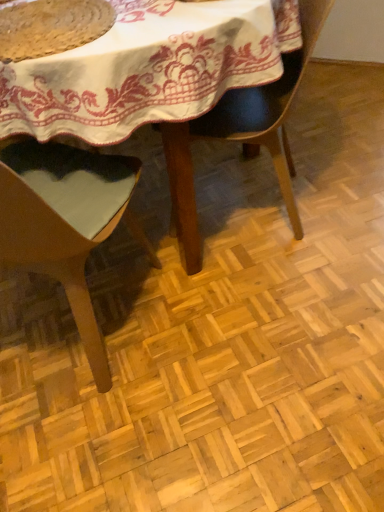
Question: Is light brown wood chair at center, which ranks as the 1th chair in left-to-right order, closer to the viewer compared to rustic woven mat at upper left?

Choices:
 (A) no
 (B) yes

Answer: (B)

Question: Does light brown wood chair at center, which ranks as the 1th chair in left-to-right order, have a lesser height compared to rustic woven mat at upper left?

Choices:
 (A) no
 (B) yes

Answer: (A)

Question: Is light brown wood chair at center, arranged as the second chair when viewed from the right, bigger than rustic woven mat at upper left?

Choices:
 (A) yes
 (B) no

Answer: (A)

Question: From a real-world perspective, is light brown wood chair at center, arranged as the second chair when viewed from the right, on rustic woven mat at upper left?

Choices:
 (A) no
 (B) yes

Answer: (A)

Question: Considering the relative sizes of light brown wood chair at center, arranged as the second chair when viewed from the right, and rustic woven mat at upper left in the image provided, is light brown wood chair at center, arranged as the second chair when viewed from the right, thinner than rustic woven mat at upper left?

Choices:
 (A) no
 (B) yes

Answer: (A)

Question: Considering the positions of point (29, 38) and point (246, 0), is point (29, 38) closer or farther from the camera than point (246, 0)?

Choices:
 (A) farther
 (B) closer

Answer: (B)

Question: From their relative heights in the image, would you say rustic woven mat at upper left is taller or shorter than wooden table at center?

Choices:
 (A) tall
 (B) short

Answer: (B)

Question: From the image's perspective, is rustic woven mat at upper left positioned above or below wooden table at center?

Choices:
 (A) below
 (B) above

Answer: (A)

Question: From a real-world perspective, is rustic woven mat at upper left physically located above or below wooden table at center?

Choices:
 (A) below
 (B) above

Answer: (B)

Question: Based on their sizes in the image, would you say wooden table at center is bigger or smaller than matte black chair at center, placed as the first chair when sorted from right to left?

Choices:
 (A) big
 (B) small

Answer: (A)

Question: In the image, is wooden table at center on the left side or the right side of matte black chair at center, placed as the first chair when sorted from right to left?

Choices:
 (A) right
 (B) left

Answer: (B)

Question: Considering the positions of point (216, 55) and point (309, 27), is point (216, 55) closer or farther from the camera than point (309, 27)?

Choices:
 (A) farther
 (B) closer

Answer: (B)

Question: From the image's perspective, is wooden table at center above or below matte black chair at center, the 2th chair in the left-to-right sequence?

Choices:
 (A) below
 (B) above

Answer: (B)

Question: Would you say wooden table at center is inside or outside rustic woven mat at upper left?

Choices:
 (A) inside
 (B) outside

Answer: (B)

Question: Does point (11, 94) appear closer or farther from the camera than point (56, 24)?

Choices:
 (A) farther
 (B) closer

Answer: (B)